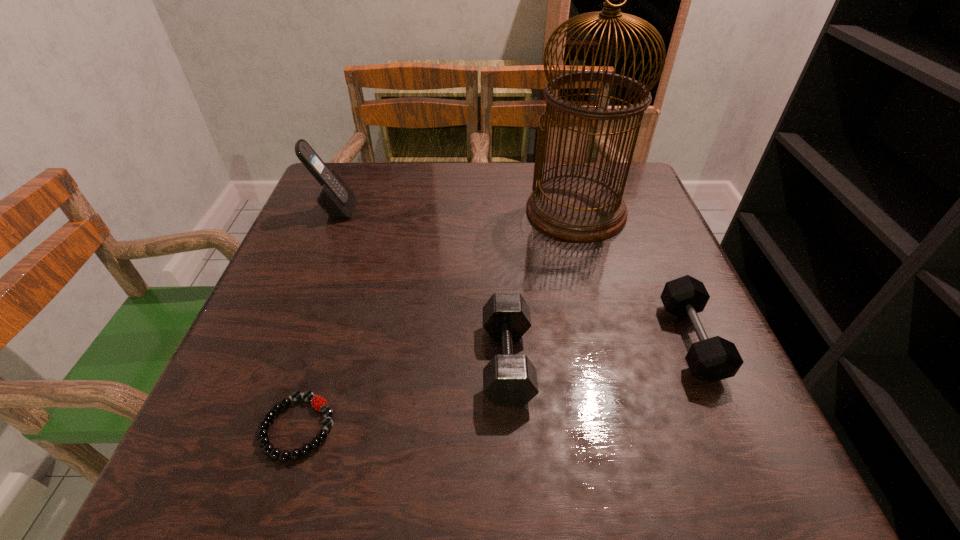
Where is `free spot that satisfies the following two spatial constraints: 1. on the front-facing side of the right dumbbell; 2. on the right side of the cellular telephone`? free spot that satisfies the following two spatial constraints: 1. on the front-facing side of the right dumbbell; 2. on the right side of the cellular telephone is located at coordinates (282, 340).